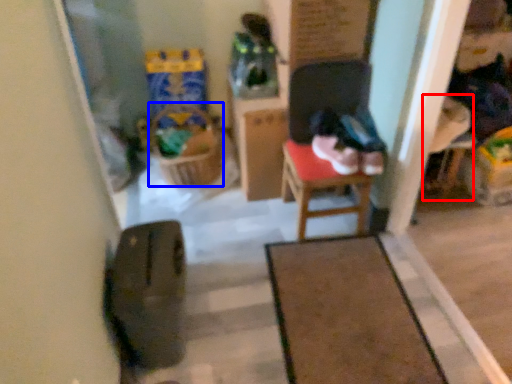
Question: Which point is closer to the camera, armchair (highlighted by a red box) or laundry basket (highlighted by a blue box)?

Choices:
 (A) armchair
 (B) laundry basket

Answer: (A)